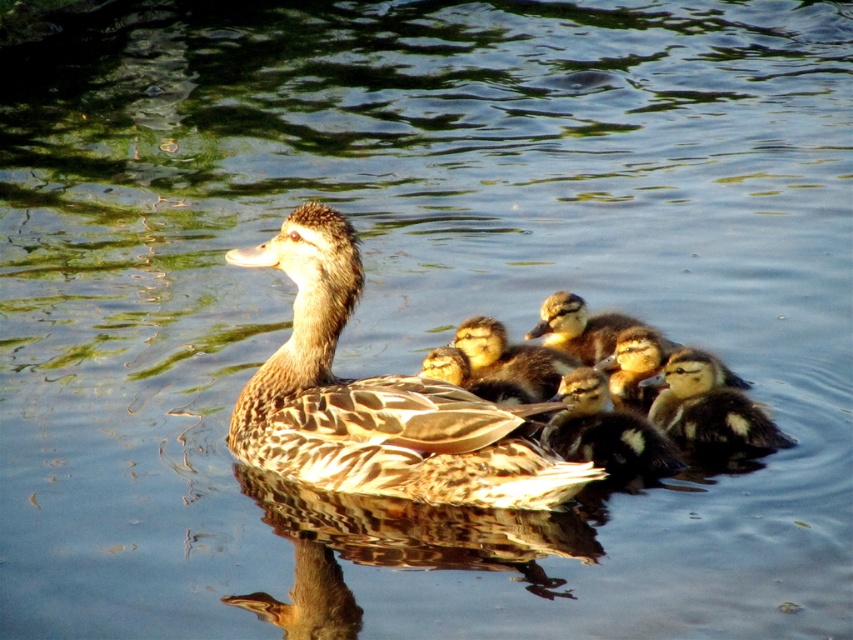
Who is more distant from viewer, (654, 451) or (515, 349)?

The point (515, 349) is more distant.

Find the location of a particular element. The image size is (853, 640). black speckled ducklings at center is located at coordinates (605, 429).

Locate an element on the screen. The height and width of the screenshot is (640, 853). black speckled ducklings at center is located at coordinates (605, 429).

Between brown speckled duckling at center and black and white fluffy ducklings at center, which one is positioned higher?

Positioned higher is brown speckled duckling at center.

Identify the location of brown speckled duckling at center. The image size is (853, 640). (376, 401).

Locate an element on the screen. The height and width of the screenshot is (640, 853). brown speckled duckling at center is located at coordinates (376, 401).

Does black and white fluffy ducklings at center have a greater width compared to black speckled ducklings at center?

Correct, the width of black and white fluffy ducklings at center exceeds that of black speckled ducklings at center.

Is black and white fluffy ducklings at center taller than black speckled ducklings at center?

In fact, black and white fluffy ducklings at center may be shorter than black speckled ducklings at center.

Measure the distance between point (764,444) and camera.

4.51 meters

The height and width of the screenshot is (640, 853). Find the location of `black and white fluffy ducklings at center`. black and white fluffy ducklings at center is located at coordinates [709, 410].